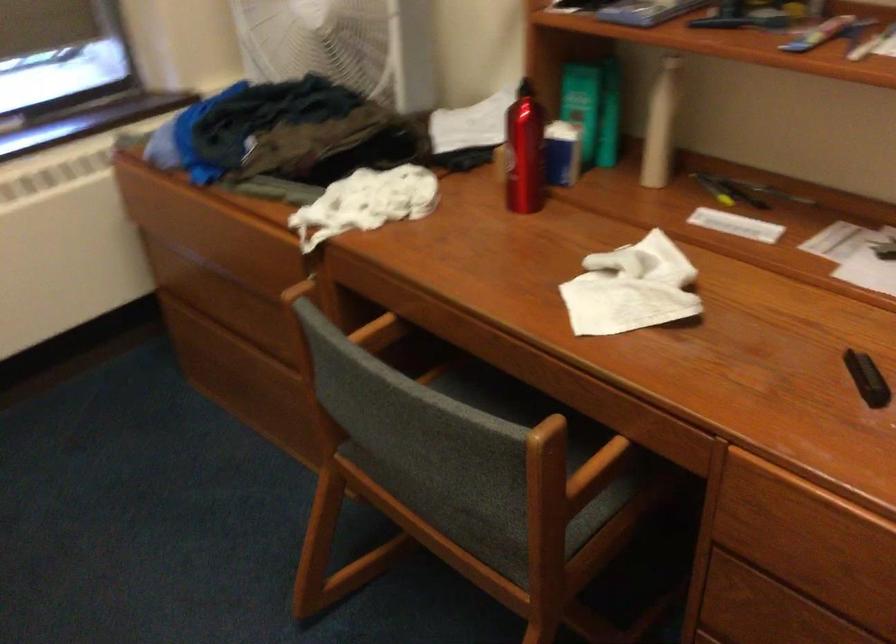
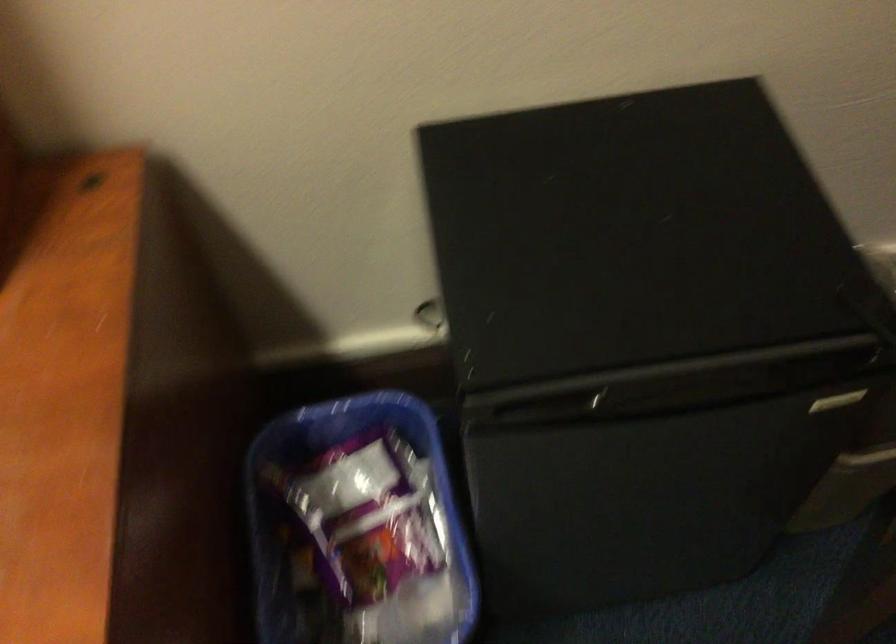
First-person continuous shooting, in which direction is the camera rotating?

The camera's rotation is toward right-down.